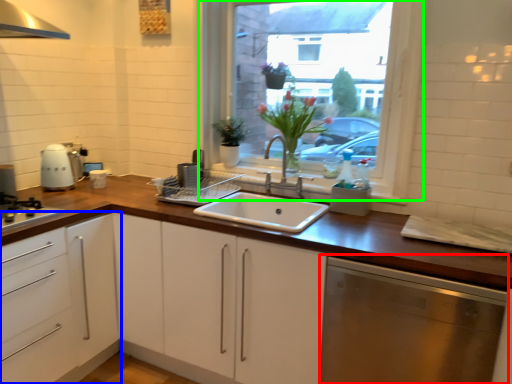
Question: Estimate the real-world distances between objects in this image. Which object is farther from dish washer (highlighted by a red box), cabinetry (highlighted by a blue box) or window (highlighted by a green box)?

Choices:
 (A) cabinetry
 (B) window

Answer: (B)